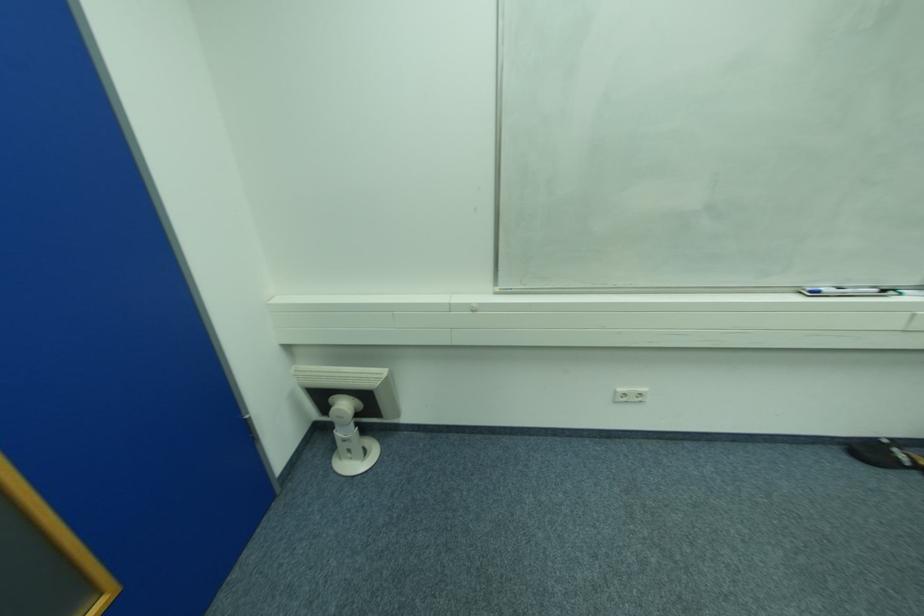
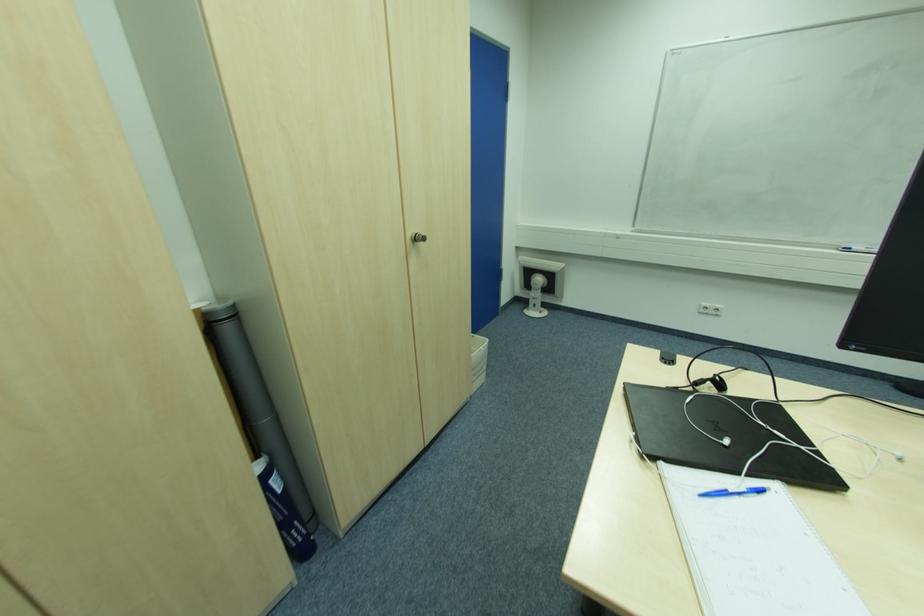
Locate, in the second image, the point that corresponds to (346,440) in the first image.

(536, 300)